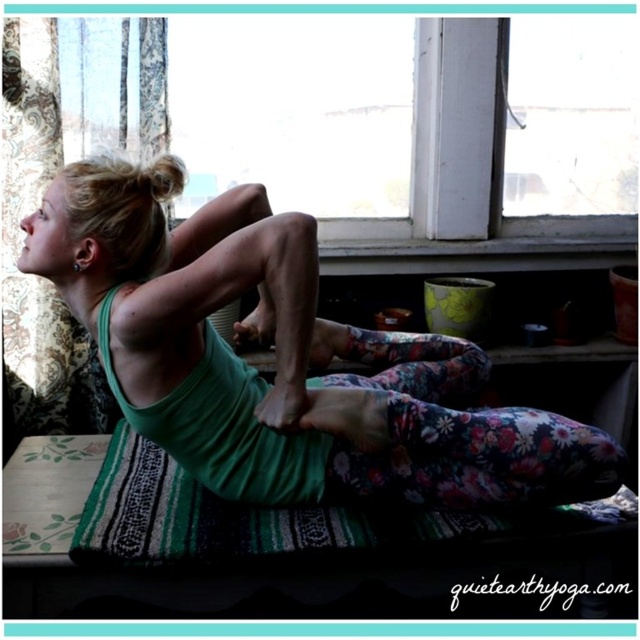
You are a photographer setting up a shoot in the room. You want to place a small stool between the green fabric yoga mat at center and the green woven yoga mat at lower center. Based on their positions, where should you position the stool relative to the two mats?

The green fabric yoga mat at center is in front of the green woven yoga mat at lower center, so the stool should be placed between them, in front of the green woven yoga mat at lower center and behind the green fabric yoga mat at center.

You are a yoga instructor preparing a class. You have two mats in the room, the green fabric yoga mat at center and the green woven yoga mat at lower center. Which mat is positioned higher up in the room?

The green fabric yoga mat at center is located above the green woven yoga mat at lower center, so it is positioned higher up in the room.

You are a drone delivering a yoga block to the person practicing yoga. The yoga block is currently at point 0.5, 0.5. What direction should you move to place it on the green fabric yoga mat at center?

The green fabric yoga mat at center is located at point (282, 358). The yoga block is at (320, 320). To reach the mat, the drone should move northeast since the x coordinate increases from 0.5 to 0.562 and the y coordinate decreases from 0.5 to 0.442.